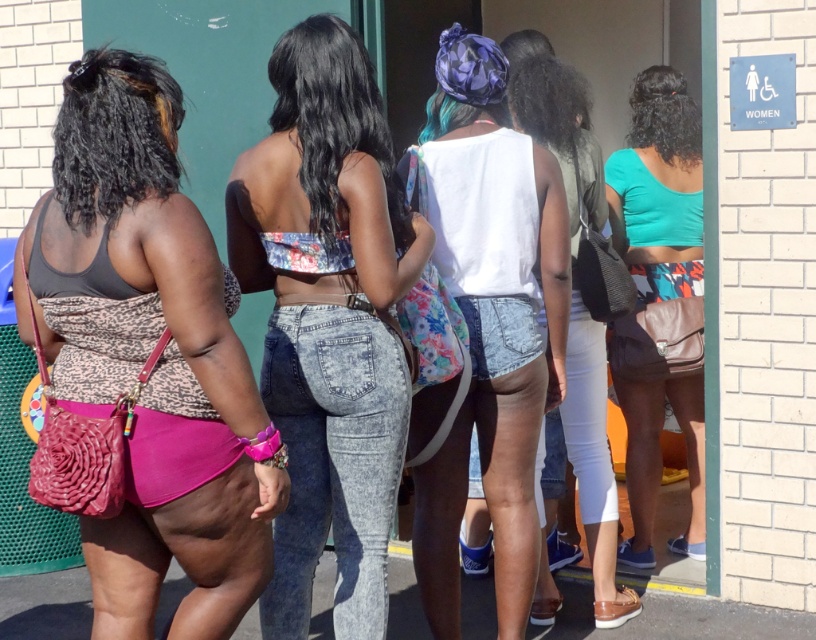
Is leopard print purse at left taller than denim shorts at center?

In fact, leopard print purse at left may be shorter than denim shorts at center.

From the picture: Can you confirm if leopard print purse at left is positioned below denim shorts at center?

Indeed, leopard print purse at left is positioned under denim shorts at center.

What do you see at coordinates (149, 356) in the screenshot?
I see `leopard print purse at left` at bounding box center [149, 356].

Locate an element on the screen. The width and height of the screenshot is (816, 640). leopard print purse at left is located at coordinates (149, 356).

Is point (415, 541) more distant than point (639, 284)?

That is False.

Between white matte tank top at center and teal matte tank top at center, which one is positioned lower?

white matte tank top at center is below.

Does point (477, 112) lie behind point (637, 458)?

No.

Where is `white matte tank top at center`? The height and width of the screenshot is (640, 816). white matte tank top at center is located at coordinates (490, 323).

Does floral fabric top at center appear on the left side of white matte tank top at center?

Indeed, floral fabric top at center is positioned on the left side of white matte tank top at center.

Which is in front, point (335, 140) or point (486, 205)?

Point (335, 140)

Find the location of a particular element. floral fabric top at center is located at coordinates (329, 317).